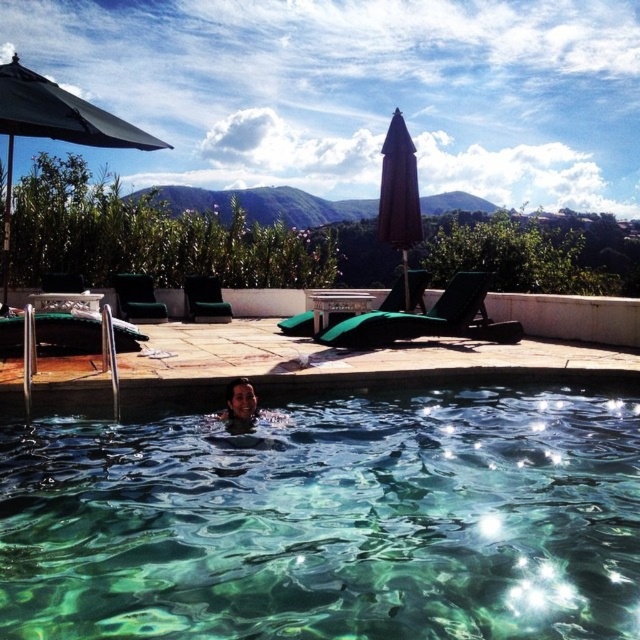
You are a GUI agent. You are given a task and a screenshot of the screen. Output one action in this format:
    pyautogui.click(x=<x>, y=<y>)
    Task: Click on the clear glass water at center
    This screenshot has height=640, width=640.
    Given the screenshot: What is the action you would take?
    pyautogui.click(x=330, y=522)

Measure the distance between point (616, 467) and camera.

Point (616, 467) and camera are 4.18 meters apart from each other.

At what (x,y) coordinates should I click in order to perform the action: click on clear glass water at center. Please return your answer as a coordinate pair (x, y). The width and height of the screenshot is (640, 640). Looking at the image, I should click on (x=330, y=522).

Is clear glass water at center positioned in front of matte black hair at lower center?

Yes, clear glass water at center is in front of matte black hair at lower center.

Who is more distant from viewer, (260, 566) or (237, 428)?

Positioned behind is point (237, 428).

Locate an element on the screen. This screenshot has width=640, height=640. clear glass water at center is located at coordinates (330, 522).

Between brown fabric umbrella at upper center and matte black hair at lower center, which one is positioned lower?

matte black hair at lower center is lower down.

Who is shorter, brown fabric umbrella at upper center or matte black hair at lower center?

Standing shorter between the two is matte black hair at lower center.

Is point (406, 227) positioned behind point (250, 424)?

Yes, it is.

You are a GUI agent. You are given a task and a screenshot of the screen. Output one action in this format:
    pyautogui.click(x=<x>, y=<y>)
    Task: Click on the brown fabric umbrella at upper center
    Image resolution: width=640 pixels, height=640 pixels.
    Given the screenshot: What is the action you would take?
    pyautogui.click(x=400, y=195)